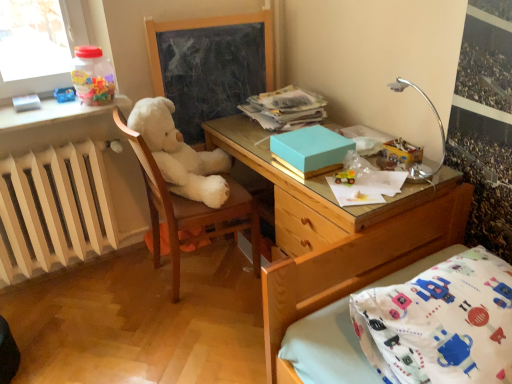
The height and width of the screenshot is (384, 512). Find the location of `free space in front of matte brown teddy bear at upper right, the 1th toy from the back`. free space in front of matte brown teddy bear at upper right, the 1th toy from the back is located at coordinates (394, 188).